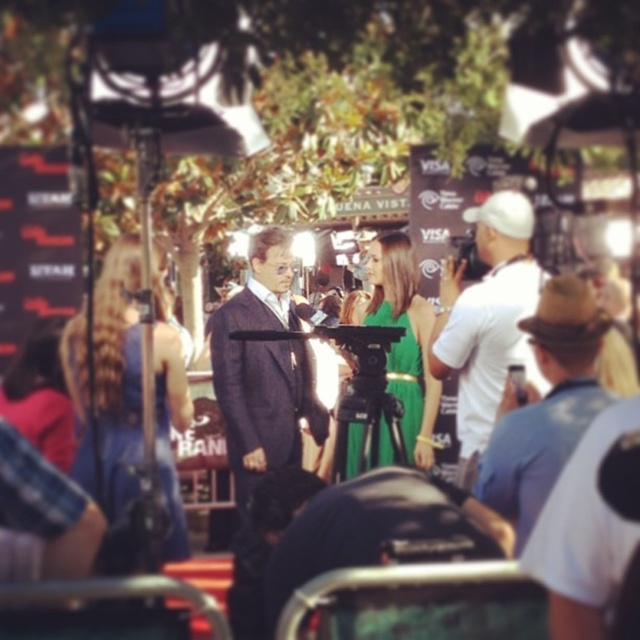
Question: Does textured navy suit at center lie in front of white cotton shirt at right?

Choices:
 (A) yes
 (B) no

Answer: (A)

Question: Based on their relative distances, which object is farther from the textured navy suit at center?

Choices:
 (A) brown felt hat at upper right
 (B) white cotton shirt at right

Answer: (A)

Question: Is white cotton shirt at right thinner than brown felt hat at upper right?

Choices:
 (A) no
 (B) yes

Answer: (B)

Question: Which point is closer to the camera?

Choices:
 (A) (506, 310)
 (B) (209, 339)
 (C) (531, 515)

Answer: (C)

Question: Which is nearer to the textured navy suit at center?

Choices:
 (A) white cotton shirt at right
 (B) brown felt hat at upper right

Answer: (A)

Question: Can you confirm if textured navy suit at center is wider than white cotton shirt at right?

Choices:
 (A) yes
 (B) no

Answer: (A)